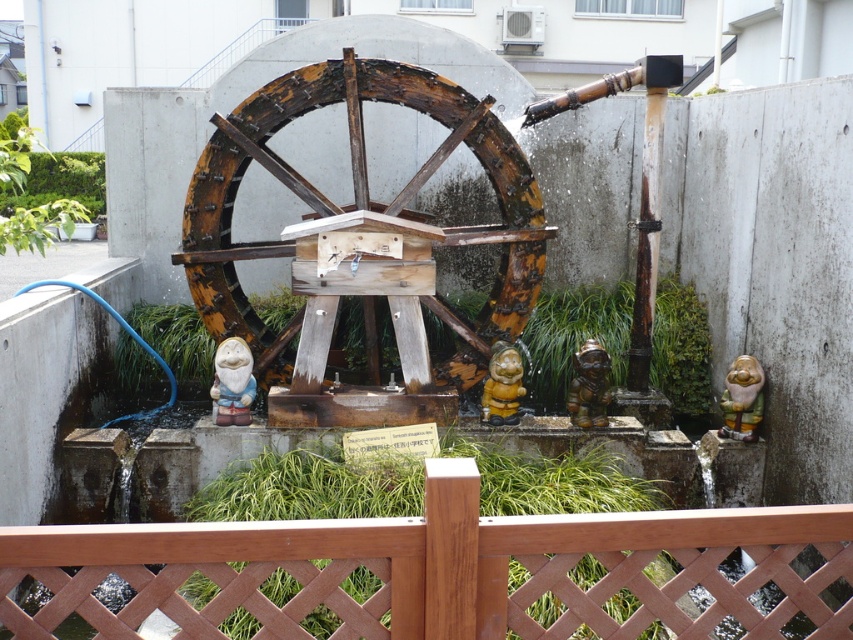
You are a visitor standing in front of the waterwheel installation. You notice the rusty wood wagon wheel at center and the green glazed ceramic gnome at center. Which object is closer to you?

The rusty wood wagon wheel at center is closer to you because it is in front of the green glazed ceramic gnome at center.

You are standing at the center of the garden and looking towards the waterwheel. There are two points marked in the scene, point 1 at coordinates point (254, 380) and point 2 at coordinates point (512, 364). Which point is closer to you?

Point (512, 364) is closer to you because it is in front of point (254, 380).